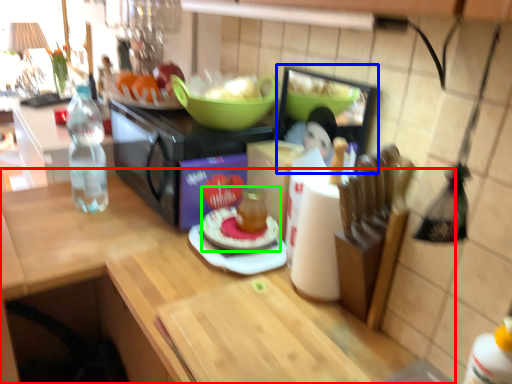
Question: Based on their relative distances, which object is nearer to countertop (highlighted by a red box)? Choose from appliance (highlighted by a blue box) and meal (highlighted by a green box).

Choices:
 (A) appliance
 (B) meal

Answer: (B)